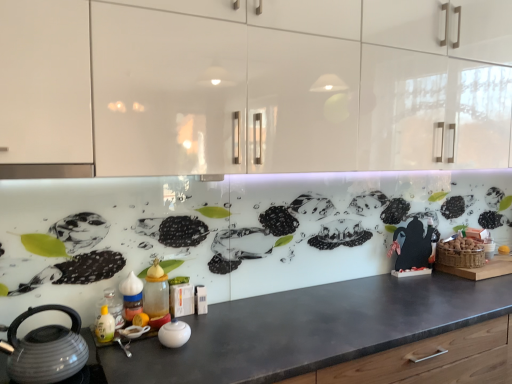
This screenshot has width=512, height=384. What are the coordinates of `vacant space in front of white glossy bowl at center` in the screenshot? It's located at (164, 361).